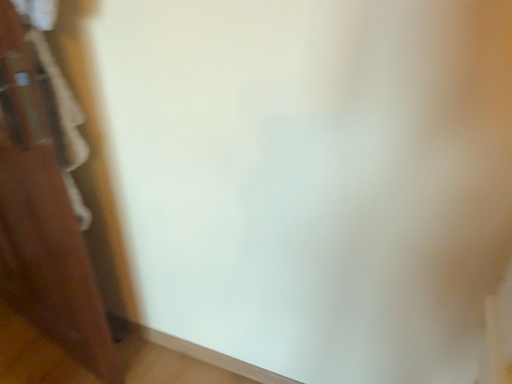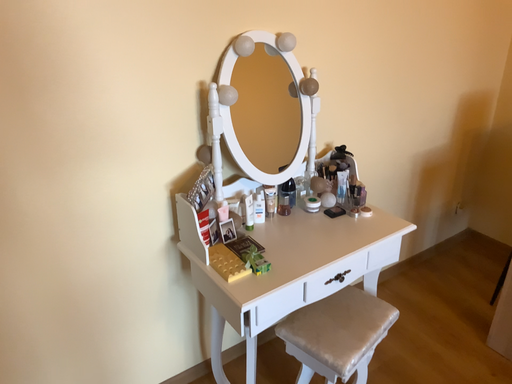
Question: How did the camera likely rotate when shooting the video?

Choices:
 (A) rotated left
 (B) rotated right

Answer: (B)